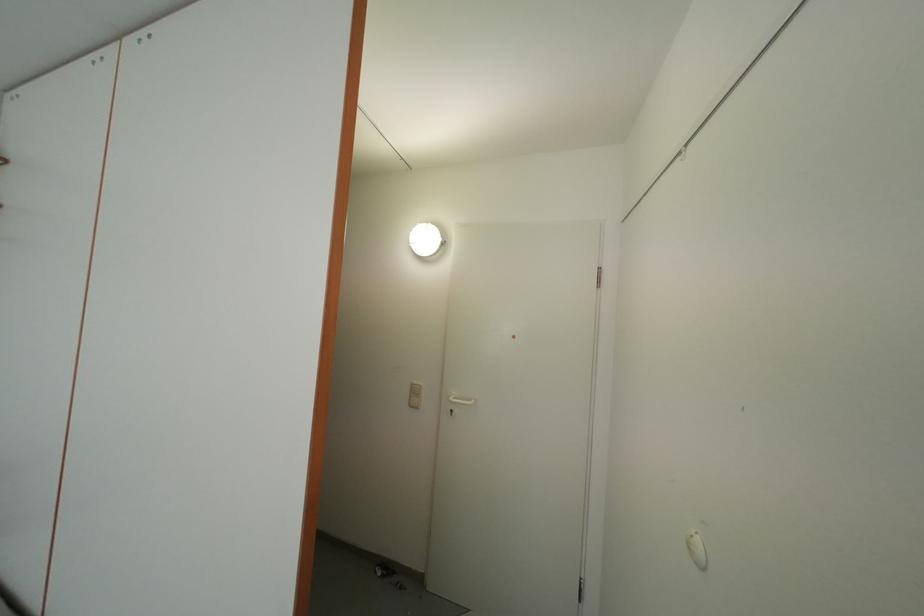
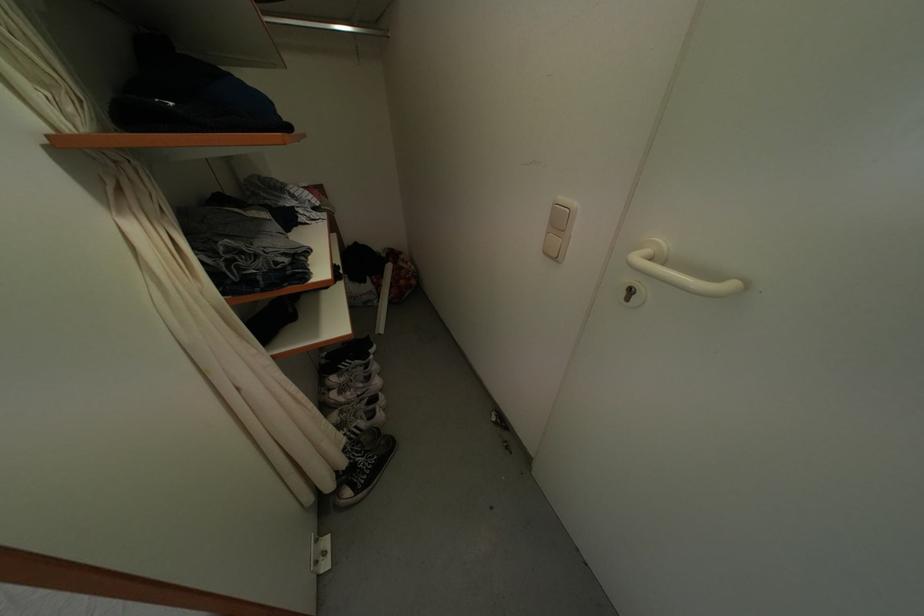
Where in the second image is the point corresponding to the point at 479,407 from the first image?

(739, 291)